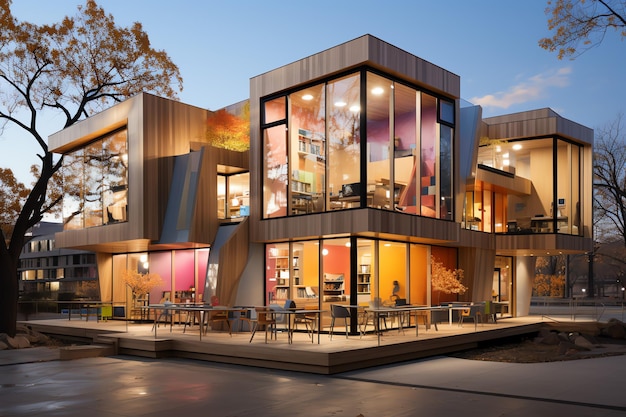
Where is `window`? This screenshot has height=417, width=626. window is located at coordinates (104, 186), (339, 156), (336, 271), (181, 284), (68, 283), (529, 165), (515, 285).